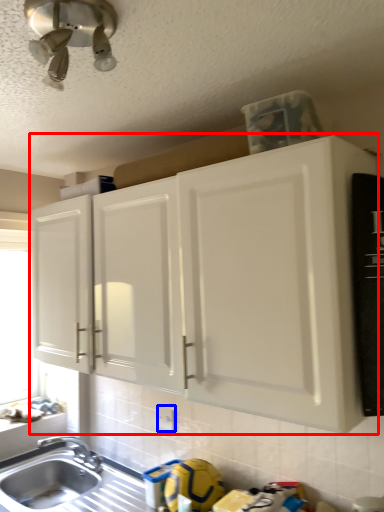
Question: Which point is closer to the camera, cabinetry (highlighted by a red box) or electric outlet (highlighted by a blue box)?

Choices:
 (A) cabinetry
 (B) electric outlet

Answer: (A)